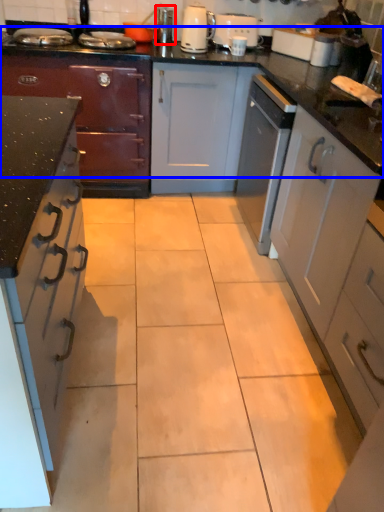
Question: Which object is closer to the camera taking this photo, appliance (highlighted by a red box) or countertop (highlighted by a blue box)?

Choices:
 (A) appliance
 (B) countertop

Answer: (B)